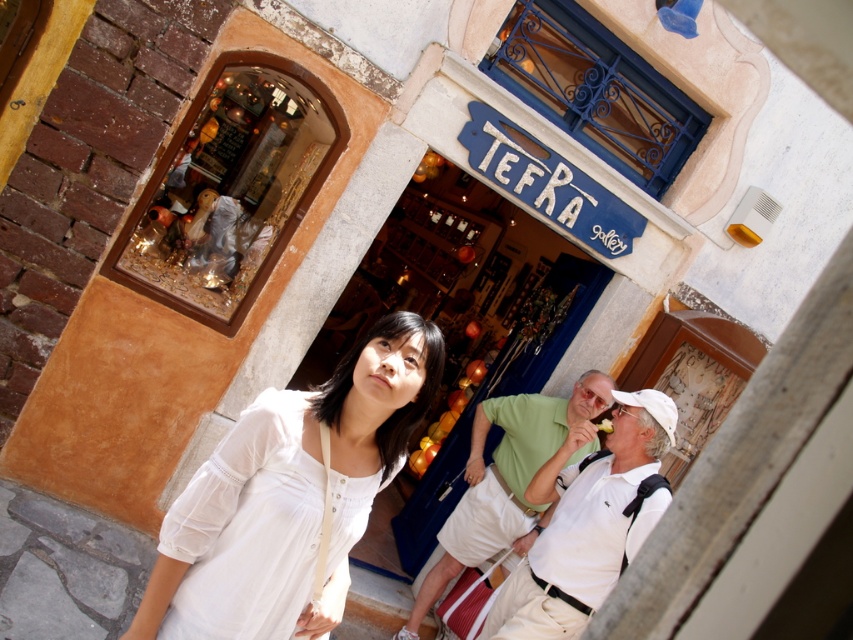
In the scene shown: Which is above, white cotton blouse at center or white cotton shirt at center?

Positioned higher is white cotton blouse at center.

Looking at this image, is white cotton blouse at center positioned before white cotton shirt at center?

Yes.

Does point (300, 518) come in front of point (490, 522)?

That is True.

Identify the location of white cotton blouse at center. This screenshot has width=853, height=640. (288, 493).

Is point (213, 458) closer to camera compared to point (653, 404)?

Yes, point (213, 458) is closer to viewer.

Is white cotton blouse at center positioned at the back of white cotton shirt at lower right?

No, white cotton blouse at center is closer to the viewer.

Is point (283, 634) positioned after point (611, 547)?

No, it is not.

I want to click on white cotton blouse at center, so click(x=288, y=493).

Who is shorter, white cotton shirt at lower right or white cotton shirt at center?

white cotton shirt at lower right is shorter.

Find the location of a particular element. This screenshot has height=640, width=853. white cotton shirt at lower right is located at coordinates (585, 522).

At what (x,y) coordinates should I click in order to perform the action: click on white cotton shirt at lower right. Please return your answer as a coordinate pair (x, y). Image resolution: width=853 pixels, height=640 pixels. Looking at the image, I should click on (585, 522).